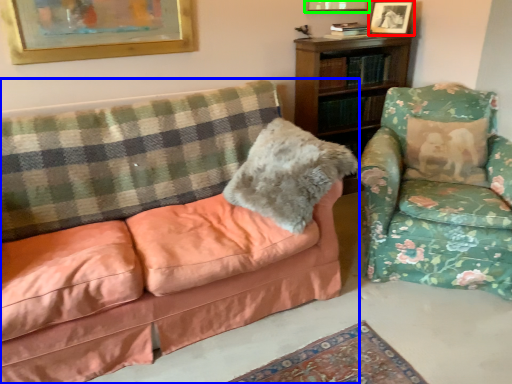
Question: Which is nearer to the picture frame (highlighted by a red box)? studio couch (highlighted by a blue box) or picture frame (highlighted by a green box).

Choices:
 (A) studio couch
 (B) picture frame

Answer: (B)